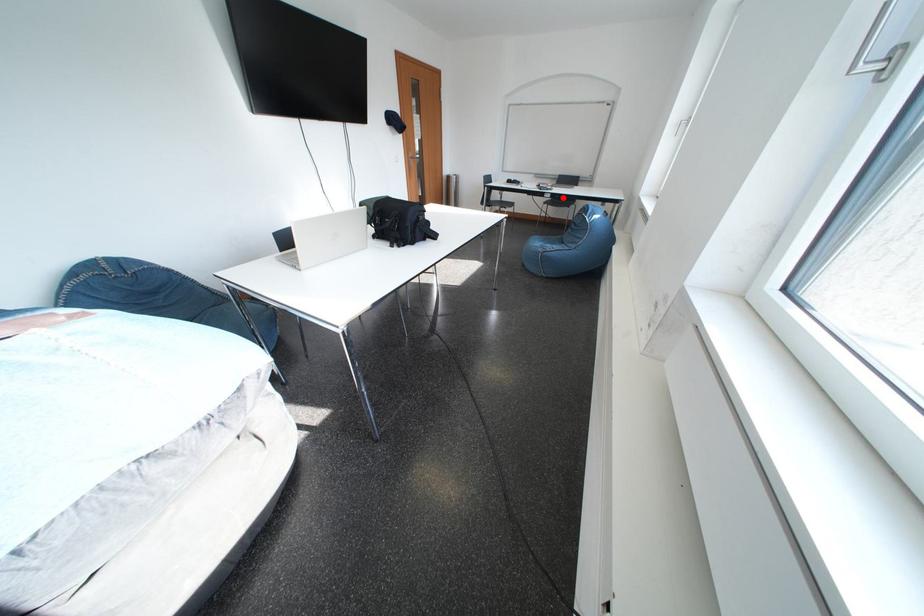
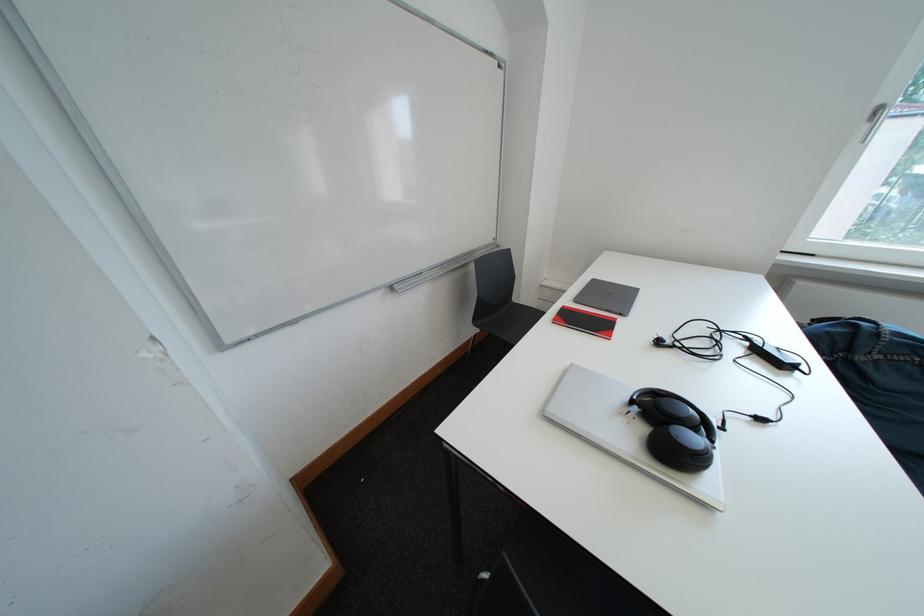
Question: I am providing you with two images of the same scene from different viewpoints. A red point is marked on the first image. At the location where the point appears in image 1, is it still visible in image 2?

Choices:
 (A) Yes
 (B) No

Answer: (B)